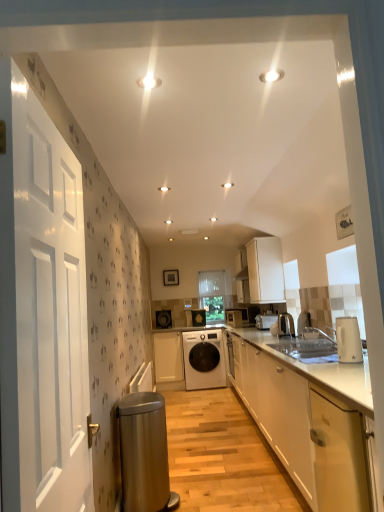
Question: In the image, is metallic silver kettle at right, marked as the 5th appliance in a back-to-front arrangement, positioned in front of or behind matte black washing machine at center, the 2th appliance from the back?

Choices:
 (A) front
 (B) behind

Answer: (A)

Question: From the image's perspective, is metallic silver kettle at right, marked as the 5th appliance in a back-to-front arrangement, positioned above or below matte black washing machine at center, the 5th appliance positioned from the front?

Choices:
 (A) below
 (B) above

Answer: (B)

Question: Considering the real-world distances, which object is closest to the white glossy electric kettle at right?

Choices:
 (A) white glossy cabinet at lower right, the 2th cabinetry in the left-to-right sequence
 (B) white glossy door at left
 (C) matte black washing machine at center, the 5th appliance positioned from the front
 (D) white glossy cabinet at lower right, arranged as the 2th cabinetry when viewed from the right
 (E) white matte cabinet at center, which appears as the first cabinetry when viewed from the back

Answer: (A)

Question: Which object is positioned closest to the satin silver kettle at right, which is the sixth appliance from back to front?

Choices:
 (A) matte black washing machine at center, the 5th appliance positioned from the front
 (B) stainless steel water heater at lower left
 (C) white glossy electric kettle at right
 (D) white glossy toaster at center, the fourth appliance viewed from the back
 (E) white glossy cabinet at lower right, the third cabinetry from the right

Answer: (D)